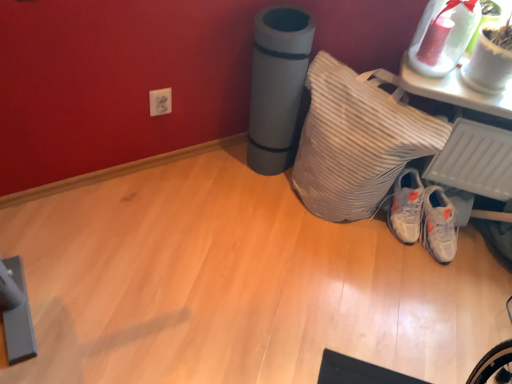
Question: Is white matte sneakers at lower right not close to white striped pillow at lower right?

Choices:
 (A) yes
 (B) no

Answer: (B)

Question: Considering the relative sizes of white matte sneakers at lower right and white striped pillow at lower right in the image provided, is white matte sneakers at lower right taller than white striped pillow at lower right?

Choices:
 (A) yes
 (B) no

Answer: (B)

Question: Is white striped pillow at lower right inside white matte sneakers at lower right?

Choices:
 (A) yes
 (B) no

Answer: (B)

Question: Can you confirm if white matte sneakers at lower right is shorter than white striped pillow at lower right?

Choices:
 (A) no
 (B) yes

Answer: (B)

Question: Does white matte sneakers at lower right have a greater width compared to white striped pillow at lower right?

Choices:
 (A) yes
 (B) no

Answer: (B)

Question: Does white matte sneakers at lower right have a smaller size compared to white striped pillow at lower right?

Choices:
 (A) yes
 (B) no

Answer: (A)

Question: From a real-world perspective, is white glossy vase at upper right located beneath white striped pillow at lower right?

Choices:
 (A) no
 (B) yes

Answer: (A)

Question: Are white glossy vase at upper right and white striped pillow at lower right beside each other?

Choices:
 (A) no
 (B) yes

Answer: (A)

Question: Is white glossy vase at upper right facing away from white striped pillow at lower right?

Choices:
 (A) no
 (B) yes

Answer: (A)

Question: Is white glossy vase at upper right far away from white striped pillow at lower right?

Choices:
 (A) no
 (B) yes

Answer: (A)

Question: Does white glossy vase at upper right appear on the right side of white striped pillow at lower right?

Choices:
 (A) no
 (B) yes

Answer: (B)

Question: Does white glossy vase at upper right have a lesser height compared to white striped pillow at lower right?

Choices:
 (A) no
 (B) yes

Answer: (B)

Question: From a real-world perspective, is white striped pillow at lower right located beneath white glossy vase at upper right?

Choices:
 (A) yes
 (B) no

Answer: (A)